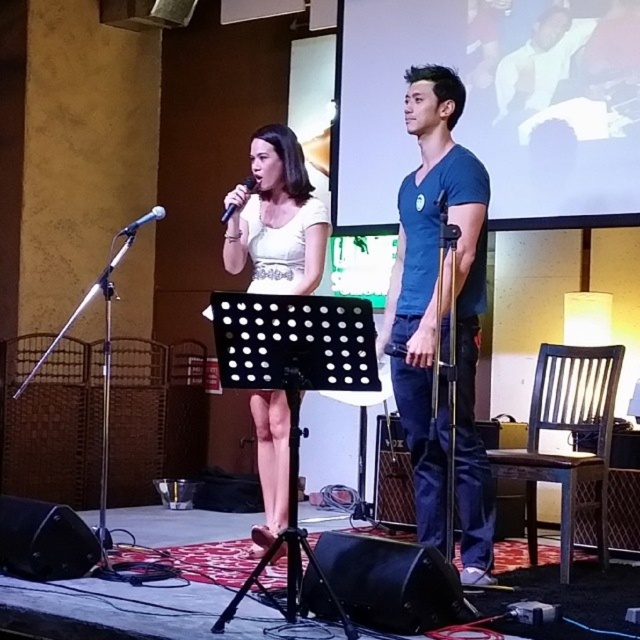
Question: Based on their relative distances, which object is nearer to the black fabric stage at center?

Choices:
 (A) blue cotton t-shirt at center
 (B) matte black microphone at center

Answer: (A)

Question: Does white satin dress at center have a smaller size compared to white shirt at upper right?

Choices:
 (A) no
 (B) yes

Answer: (A)

Question: Which point is closer to the camera?

Choices:
 (A) (136, 220)
 (B) (140, 525)

Answer: (B)

Question: Observing the image, what is the correct spatial positioning of white shirt at upper right in reference to matte black microphone at center?

Choices:
 (A) above
 (B) below

Answer: (A)

Question: Estimate the real-world distances between objects in this image. Which object is closer to the matte black microphone at center?

Choices:
 (A) blue cotton t-shirt at center
 (B) white satin dress at center

Answer: (B)

Question: Is white shirt at upper right smaller than matte black microphone at center?

Choices:
 (A) no
 (B) yes

Answer: (A)